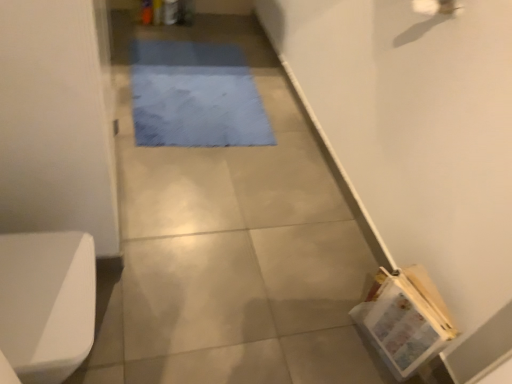
This screenshot has height=384, width=512. Describe the element at coordinates (195, 96) in the screenshot. I see `blue fabric mat at center` at that location.

Image resolution: width=512 pixels, height=384 pixels. Identify the location of blue fabric mat at center. (195, 96).

What is the approximate width of white glossy toilet bowl at lower left?

The width of white glossy toilet bowl at lower left is 12.54 inches.

This screenshot has width=512, height=384. Describe the element at coordinates (47, 303) in the screenshot. I see `white glossy toilet bowl at lower left` at that location.

Looking at this image, in order to face white glossy toilet bowl at lower left, should I rotate leftwards or rightwards?

Turn left by 26.688 degrees to look at white glossy toilet bowl at lower left.

Locate an element on the screen. This screenshot has width=512, height=384. white glossy toilet bowl at lower left is located at coordinates (47, 303).

At what (x,y) coordinates should I click in order to perform the action: click on blue fabric mat at center. Please return your answer as a coordinate pair (x, y). Looking at the image, I should click on (195, 96).

Considering the relative positions of white glossy toilet bowl at lower left and blue fabric mat at center in the image provided, is white glossy toilet bowl at lower left to the right of blue fabric mat at center from the viewer's perspective?

No, white glossy toilet bowl at lower left is not to the right of blue fabric mat at center.

Is white glossy toilet bowl at lower left positioned behind blue fabric mat at center?

No, it is not.

Between point (68, 345) and point (211, 108), which one is positioned in front?

The point (68, 345) is closer.

From the image's perspective, which one is positioned higher, white glossy toilet bowl at lower left or blue fabric mat at center?

blue fabric mat at center.

From a real-world perspective, is white glossy toilet bowl at lower left positioned under blue fabric mat at center based on gravity?

No, from a real-world perspective, white glossy toilet bowl at lower left is not under blue fabric mat at center.

In terms of width, does white glossy toilet bowl at lower left look wider or thinner when compared to blue fabric mat at center?

In the image, white glossy toilet bowl at lower left appears to be more narrow than blue fabric mat at center.

Who is shorter, white glossy toilet bowl at lower left or blue fabric mat at center?

blue fabric mat at center is shorter.

Considering the relative sizes of white glossy toilet bowl at lower left and blue fabric mat at center in the image provided, is white glossy toilet bowl at lower left smaller than blue fabric mat at center?

No, white glossy toilet bowl at lower left is not smaller than blue fabric mat at center.

Is white glossy toilet bowl at lower left surrounding blue fabric mat at center?

That's incorrect, blue fabric mat at center is not inside white glossy toilet bowl at lower left.

Is the surface of white glossy toilet bowl at lower left in direct contact with blue fabric mat at center?

No, white glossy toilet bowl at lower left is not next to blue fabric mat at center.

Could you tell me if white glossy toilet bowl at lower left is facing blue fabric mat at center?

No, white glossy toilet bowl at lower left is not turned towards blue fabric mat at center.

Find the location of a particular element. toilet bowl above the blue fabric mat at center (from a real-world perspective) is located at coordinates (47, 303).

In the image, is blue fabric mat at center on the left side or the right side of white glossy toilet bowl at lower left?

blue fabric mat at center is positioned on white glossy toilet bowl at lower left's right side.

Is blue fabric mat at center closer to camera compared to white glossy toilet bowl at lower left?

That is False.

Which is less distant, (262, 106) or (35, 368)?

Point (262, 106) is positioned farther from the camera compared to point (35, 368).

From the image's perspective, is blue fabric mat at center on top of white glossy toilet bowl at lower left?

Yes.

From a real-world perspective, relative to white glossy toilet bowl at lower left, is blue fabric mat at center vertically above or below?

blue fabric mat at center is below white glossy toilet bowl at lower left.

Looking at their sizes, would you say blue fabric mat at center is wider or thinner than white glossy toilet bowl at lower left?

blue fabric mat at center is wider than white glossy toilet bowl at lower left.

Does blue fabric mat at center have a lesser height compared to white glossy toilet bowl at lower left?

Yes, blue fabric mat at center is shorter than white glossy toilet bowl at lower left.

Is blue fabric mat at center bigger than white glossy toilet bowl at lower left?

No.

Does blue fabric mat at center contain white glossy toilet bowl at lower left?

No, white glossy toilet bowl at lower left is not inside blue fabric mat at center.

Are blue fabric mat at center and white glossy toilet bowl at lower left making contact?

blue fabric mat at center and white glossy toilet bowl at lower left are not in contact.

Does blue fabric mat at center turn towards white glossy toilet bowl at lower left?

No, blue fabric mat at center is not aimed at white glossy toilet bowl at lower left.

In the scene shown: What's the angular difference between blue fabric mat at center and white glossy toilet bowl at lower left's facing directions?

89.6 degrees separate the facing orientations of blue fabric mat at center and white glossy toilet bowl at lower left.

Looking at this image, how far apart are blue fabric mat at center and white glossy toilet bowl at lower left?

blue fabric mat at center is 4.14 feet from white glossy toilet bowl at lower left.

Find the location of a particular element. mat above the white glossy toilet bowl at lower left (from the image's perspective) is located at coordinates (195, 96).

Locate an element on the screen. The image size is (512, 384). mat that is behind the white glossy toilet bowl at lower left is located at coordinates (195, 96).

Locate an element on the screen. Image resolution: width=512 pixels, height=384 pixels. mat lying on the right of white glossy toilet bowl at lower left is located at coordinates (195, 96).